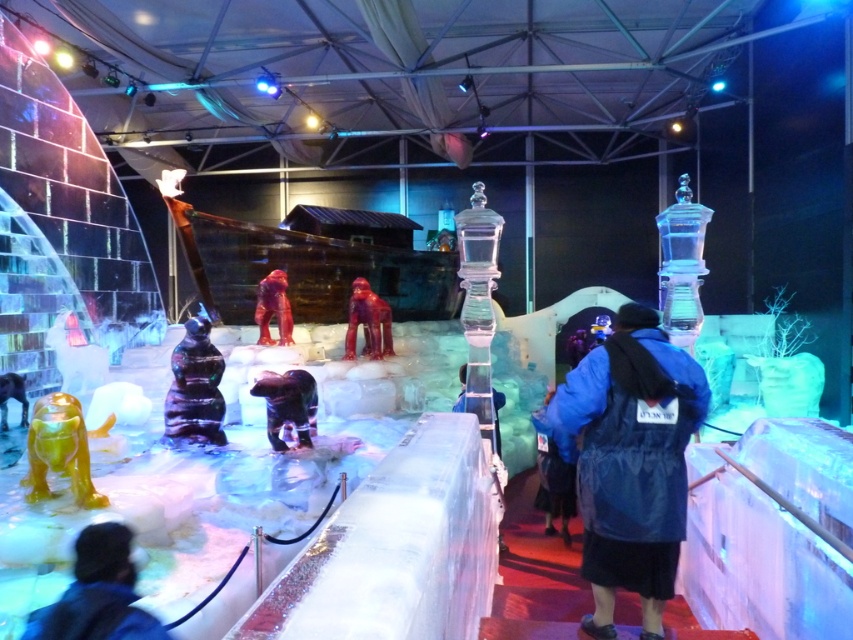
You are an event organizer planning to transport both the shiny green ice sculpture at lower left and the glossy black bear at center to another venue. Given that your transport vehicle has a 1.2 meter width limit, can both items fit side by side without exceeding the width limit?

The shiny green ice sculpture at lower left is wider than the glossy black bear at center. However, since the exact widths are not provided, we cannot confirm if their combined width exceeds 1.2 meters. Additional measurements are needed to determine feasibility.